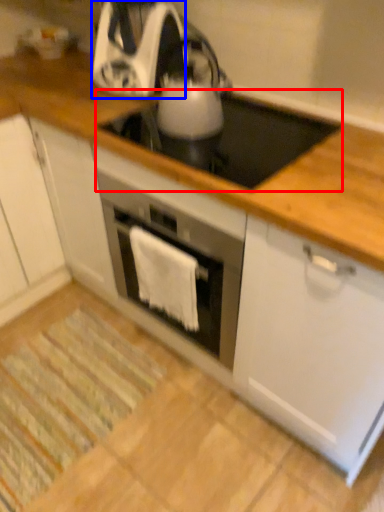
Question: Which object appears farthest to the camera in this image, gas stove (highlighted by a red box) or kitchen appliance (highlighted by a blue box)?

Choices:
 (A) gas stove
 (B) kitchen appliance

Answer: (B)